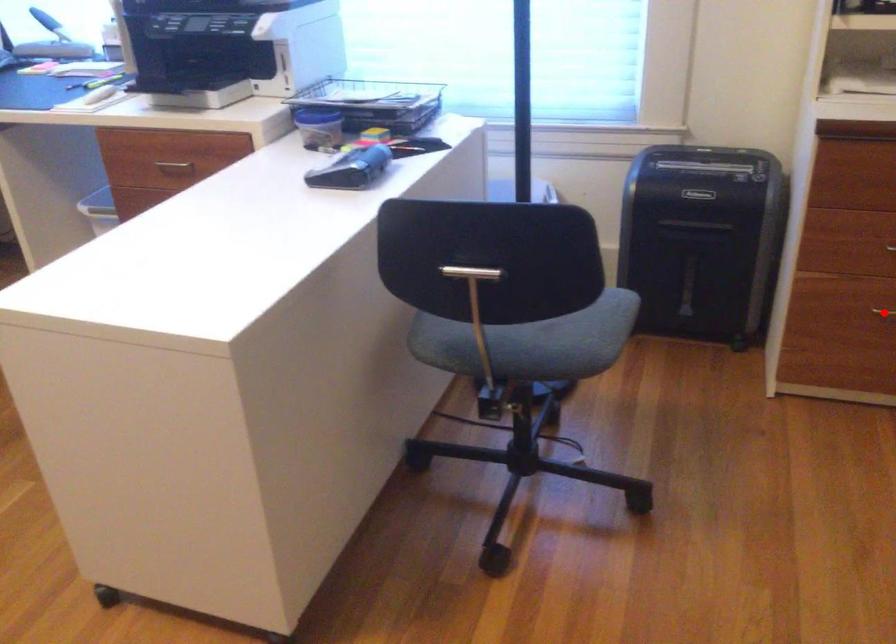
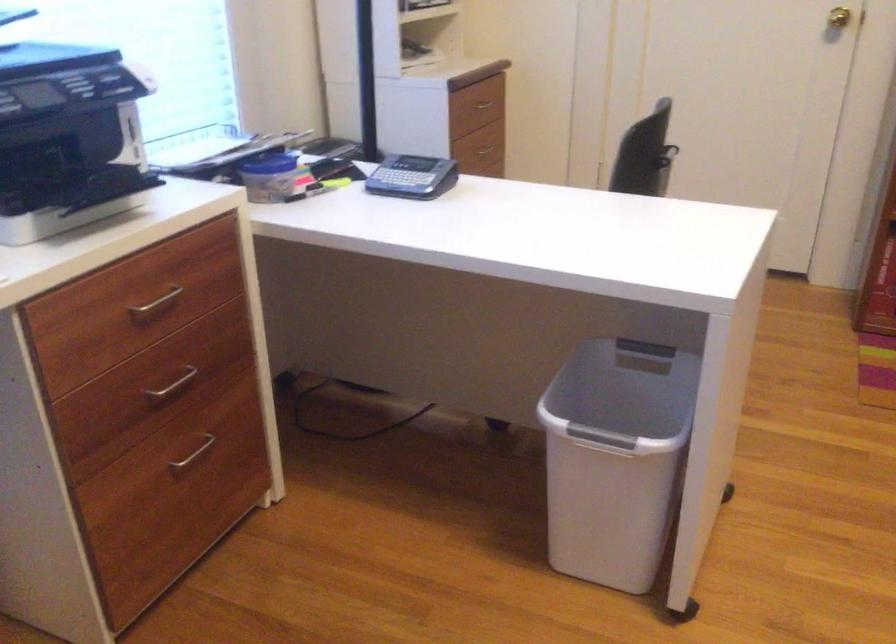
Question: I am providing you with two images of the same scene from different viewpoints. A red point is marked on the first image. Is the red point's position out of view in image 2?

Choices:
 (A) Yes
 (B) No

Answer: (A)